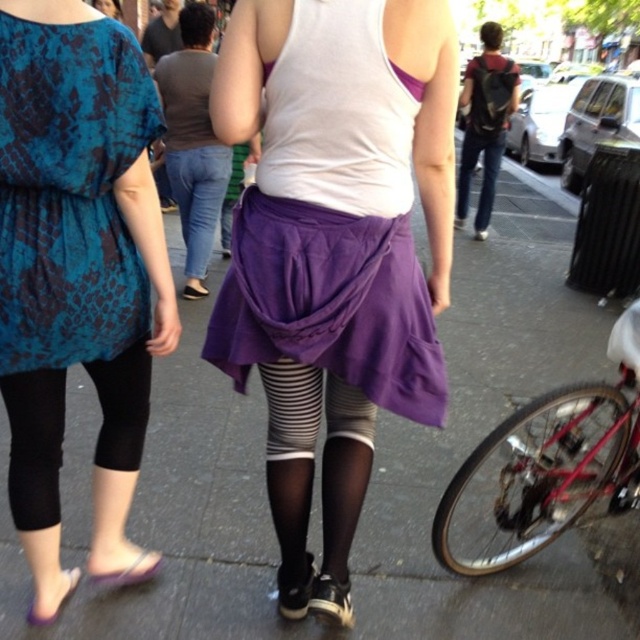
Which is above, teal snakeskin dress at upper left or purple fabric skirt at center?

purple fabric skirt at center

What do you see at coordinates (68, 192) in the screenshot? I see `teal snakeskin dress at upper left` at bounding box center [68, 192].

Between point (88, 100) and point (184, 150), which one is positioned behind?

Point (184, 150)

You are a GUI agent. You are given a task and a screenshot of the screen. Output one action in this format:
    pyautogui.click(x=<x>, y=<y>)
    Task: Click on the teal snakeskin dress at upper left
    This screenshot has width=640, height=640.
    Given the screenshot: What is the action you would take?
    pyautogui.click(x=68, y=192)

Does shiny red bicycle at lower right appear over purple fabric skirt at center?

Actually, shiny red bicycle at lower right is below purple fabric skirt at center.

Consider the image. Which is more to the right, shiny red bicycle at lower right or purple fabric skirt at center?

From the viewer's perspective, shiny red bicycle at lower right appears more on the right side.

Is point (464, 464) farther from camera compared to point (202, 278)?

No, it is not.

I want to click on shiny red bicycle at lower right, so click(x=547, y=467).

Is purple quilted skirt at center further to camera compared to teal snakeskin dress at upper left?

Yes, purple quilted skirt at center is behind teal snakeskin dress at upper left.

Does purple quilted skirt at center appear on the left side of teal snakeskin dress at upper left?

Incorrect, purple quilted skirt at center is not on the left side of teal snakeskin dress at upper left.

Does point (246, 328) come closer to viewer compared to point (45, 317)?

No, it is not.

The image size is (640, 640). Identify the location of purple quilted skirt at center. (333, 250).